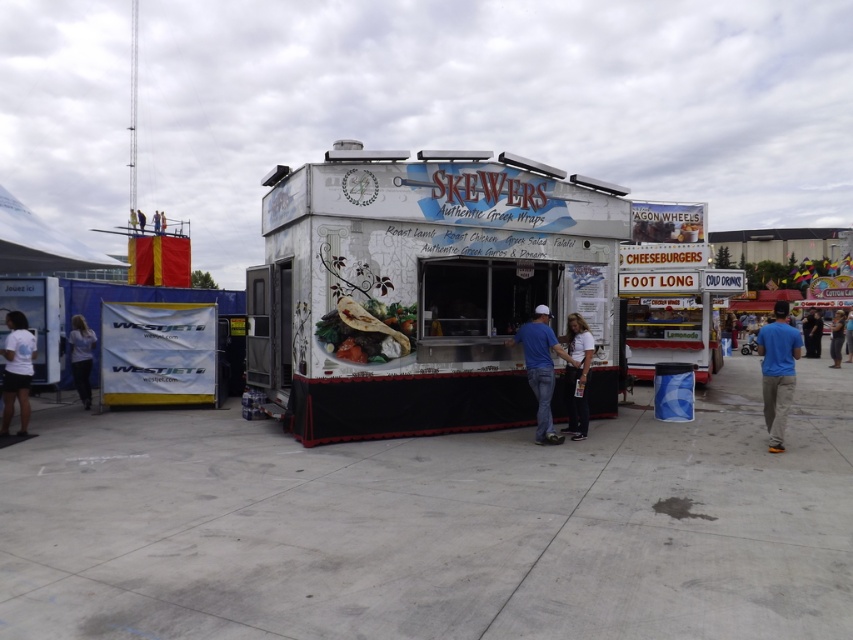
Does white glossy food truck at center have a larger size compared to blue cotton shirt at center?

Indeed, white glossy food truck at center has a larger size compared to blue cotton shirt at center.

From the picture: Who is more forward, [518,396] or [549,372]?

Point [549,372] is more forward.

Between point (567, 227) and point (532, 380), which one is positioned in front?

Point (532, 380) is in front.

At what (x,y) coordinates should I click in order to perform the action: click on white glossy food truck at center. Please return your answer as a coordinate pair (x, y). This screenshot has width=853, height=640. Looking at the image, I should click on (421, 289).

Who is taller, white t-shirt at lower left or dark blue jeans at center?

dark blue jeans at center

Who is shorter, white t-shirt at lower left or dark blue jeans at center?

white t-shirt at lower left is shorter.

The width and height of the screenshot is (853, 640). I want to click on white t-shirt at lower left, so click(x=16, y=371).

Is blue cotton shirt at center closer to the viewer compared to white t-shirt at lower left?

That is True.

This screenshot has height=640, width=853. What are the coordinates of `blue cotton shirt at center` in the screenshot? It's located at (540, 369).

The height and width of the screenshot is (640, 853). What do you see at coordinates (540, 369) in the screenshot? I see `blue cotton shirt at center` at bounding box center [540, 369].

You are a GUI agent. You are given a task and a screenshot of the screen. Output one action in this format:
    pyautogui.click(x=<x>, y=<y>)
    Task: Click on the blue cotton shirt at center
    The image size is (853, 640).
    Given the screenshot: What is the action you would take?
    pyautogui.click(x=540, y=369)